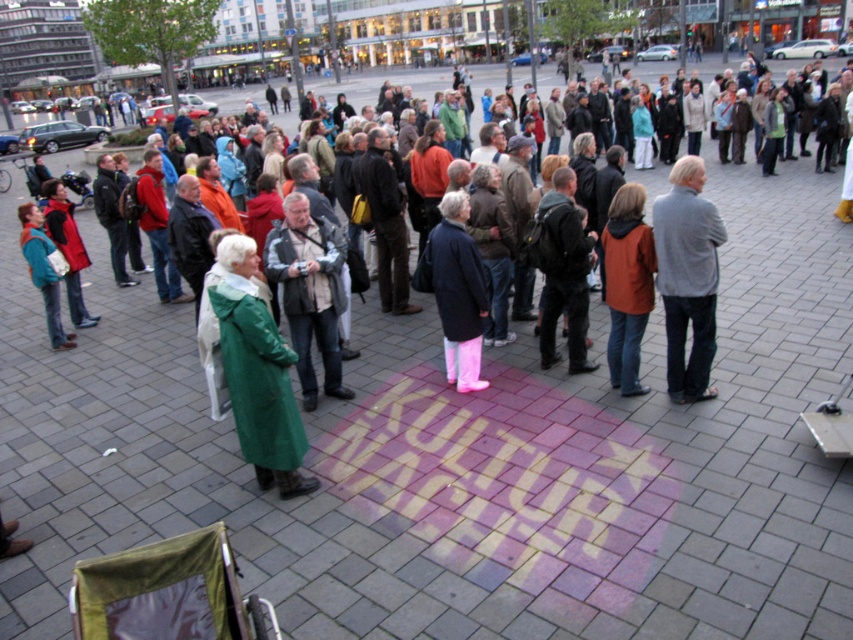
Based on the photo, you are a photographer trying to capture a clear shot of the matte orange jacket at center without the gray wool sweater at right appearing in the frame. Based on their positions, is this possible?

The gray wool sweater at right is below the matte orange jacket at center, so it might block the view. To avoid the sweater, the photographer should aim to shoot from a higher angle or position themselves so the jacket is above the sweater in the frame.

You are a photographer trying to capture a photo of the crowd while ensuring both the gray wool sweater at right and the matte orange jacket at center are visible. Given their sizes, which clothing item might appear more prominent in the photo?

The gray wool sweater at right has a larger size compared to the matte orange jacket at center, so it will appear more prominent in the photo.

You are a photographer standing at the camera position in the urban square scene. You want to capture a closeup shot of the green fabric coat at center without moving the coat. Is it possible to do so with a standard zoom lens that has a maximum zoom range of 200mm?

The green fabric coat at center is 19.32 feet away from camera. With a standard zoom lens up to 200mm, it is possible to capture a closeup shot without moving the coat because the distance is within the lens capability.